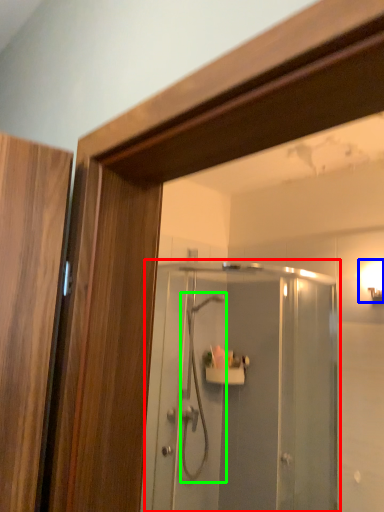
Question: Which is farther away from screen door (highlighted by a red box)? light fixture (highlighted by a blue box) or shower (highlighted by a green box)?

Choices:
 (A) light fixture
 (B) shower

Answer: (A)